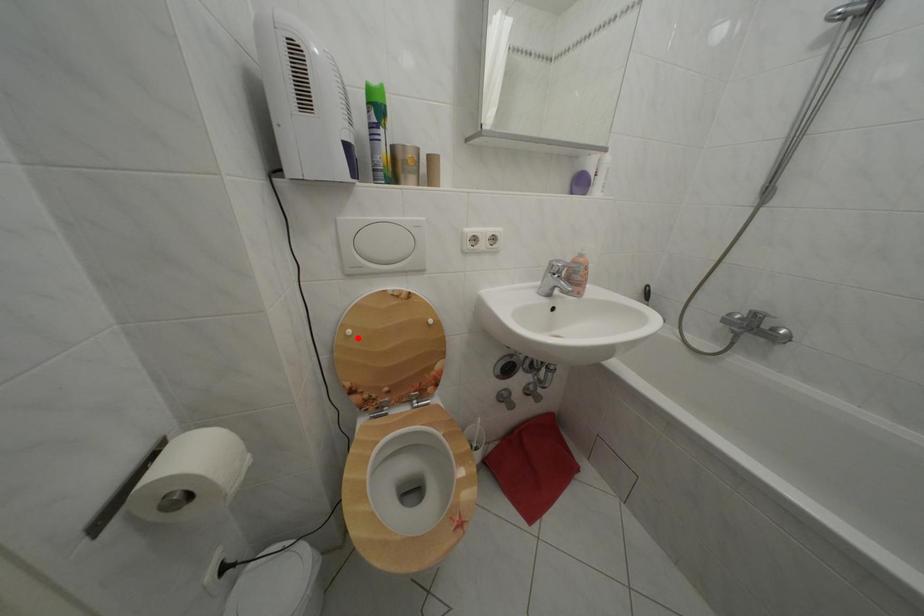
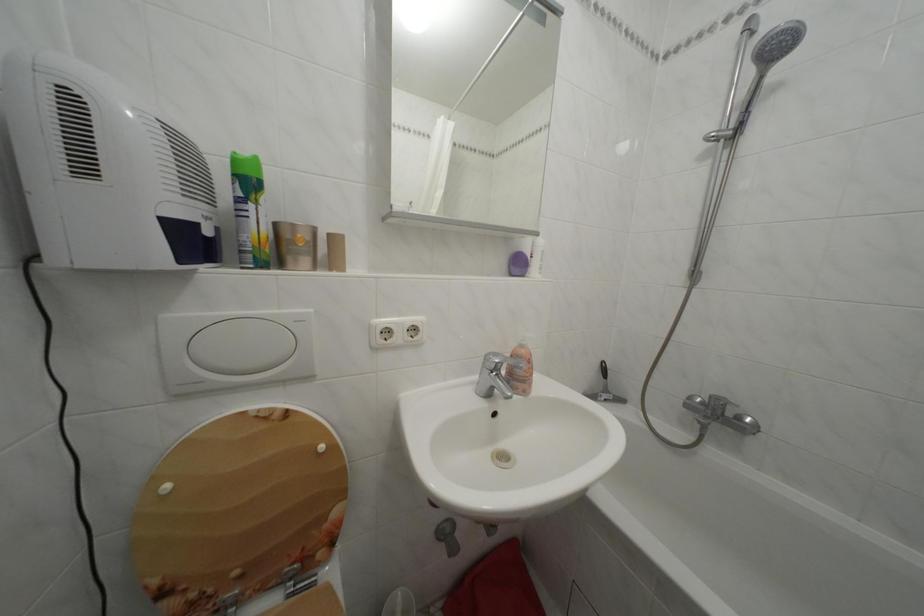
In the second image, find the point that corresponds to the highlighted location in the first image.

(176, 493)